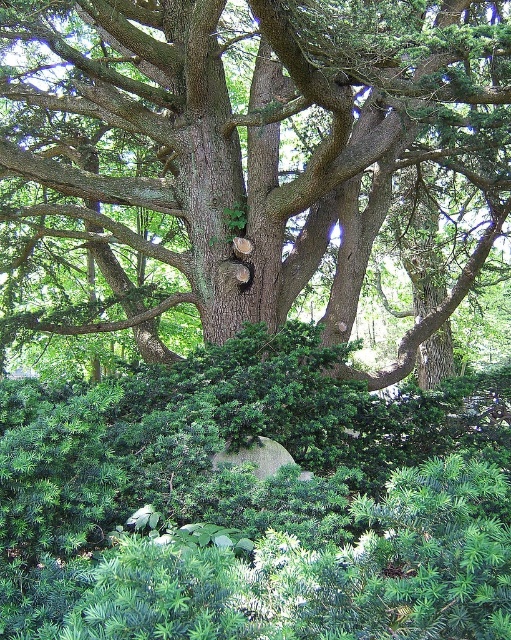
The width and height of the screenshot is (511, 640). I want to click on green needle-like bush at center, so click(256, 502).

Between point (253, 381) and point (175, 54), which one is positioned in front?

Point (253, 381) is more forward.

The image size is (511, 640). I want to click on green needle-like bush at center, so click(x=256, y=502).